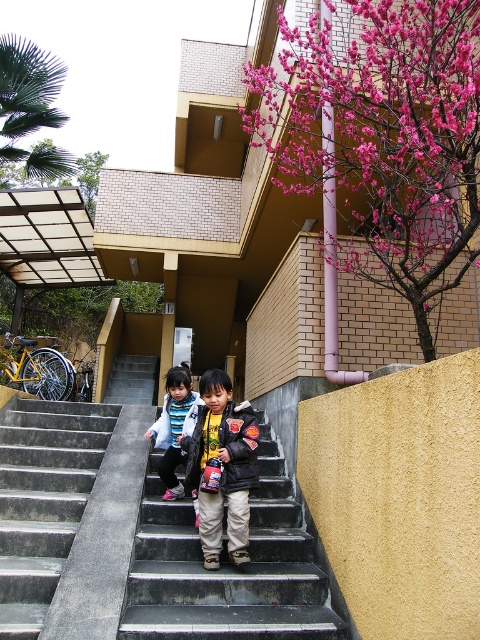
Does concrete stairs at center appear on the left side of black leather jacket at center?

Indeed, concrete stairs at center is positioned on the left side of black leather jacket at center.

What are the coordinates of `concrete stairs at center` in the screenshot? It's located at (44, 499).

Is the position of black concrete stairs at center less distant than that of concrete stairs at center?

No.

Is black concrete stairs at center above concrete stairs at center?

No, black concrete stairs at center is not above concrete stairs at center.

Is point (260, 522) positioned before point (36, 448)?

Yes, point (260, 522) is closer to viewer.

This screenshot has height=640, width=480. In order to click on black concrete stairs at center in this screenshot , I will do `click(228, 568)`.

Between black concrete stairs at center and striped fleece jacket at center, which one appears on the right side from the viewer's perspective?

black concrete stairs at center

In the scene shown: Is the position of black concrete stairs at center less distant than that of striped fleece jacket at center?

Yes, it is.

This screenshot has height=640, width=480. Identify the location of black concrete stairs at center. (228, 568).

The width and height of the screenshot is (480, 640). Identify the location of black concrete stairs at center. (228, 568).